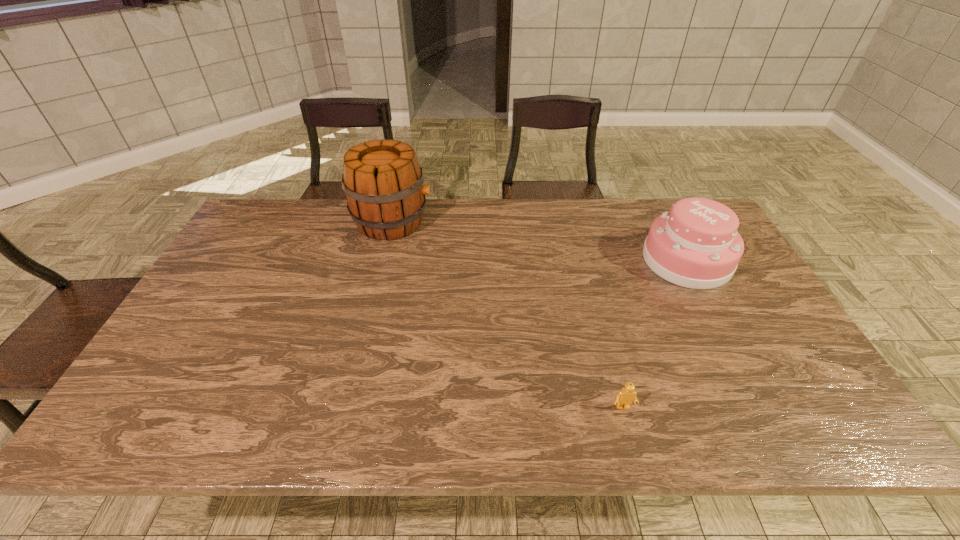
Where is `vacant space that satisfies the following two spatial constraints: 1. on the side of the birthday cake where the spigot is located; 2. on the right side of the cider`? This screenshot has width=960, height=540. vacant space that satisfies the following two spatial constraints: 1. on the side of the birthday cake where the spigot is located; 2. on the right side of the cider is located at coordinates (383, 260).

This screenshot has height=540, width=960. I want to click on free spot that satisfies the following two spatial constraints: 1. on the side of the tallest object where the spigot is located; 2. on the back side of the second tallest object, so click(x=383, y=260).

You are a GUI agent. You are given a task and a screenshot of the screen. Output one action in this format:
    pyautogui.click(x=<x>, y=<y>)
    Task: Click on the free location that satisfies the following two spatial constraints: 1. on the back side of the rightmost object; 2. on the side of the cider where the spigot is located
    This screenshot has width=960, height=540.
    Given the screenshot: What is the action you would take?
    pyautogui.click(x=666, y=221)

Find the location of a particular element. free space that satisfies the following two spatial constraints: 1. on the side of the tallest object where the spigot is located; 2. on the right side of the second shortest object is located at coordinates (383, 260).

This screenshot has width=960, height=540. Identify the location of vacant space that satisfies the following two spatial constraints: 1. on the back side of the birthday cake; 2. on the side of the leftmost object where the spigot is located. (666, 221).

Identify the location of vacant space that satisfies the following two spatial constraints: 1. on the back side of the second tallest object; 2. on the side of the leftmost object where the spigot is located. (666, 221).

I want to click on vacant position in the image that satisfies the following two spatial constraints: 1. on the side of the leftmost object where the spigot is located; 2. on the right side of the birthday cake, so click(x=383, y=260).

I want to click on free space that satisfies the following two spatial constraints: 1. on the back side of the birthday cake; 2. on the side of the leftmost object where the spigot is located, so click(666, 221).

Locate an element on the screen. vacant area in the image that satisfies the following two spatial constraints: 1. on the side of the cider where the spigot is located; 2. on the right side of the second tallest object is located at coordinates (383, 260).